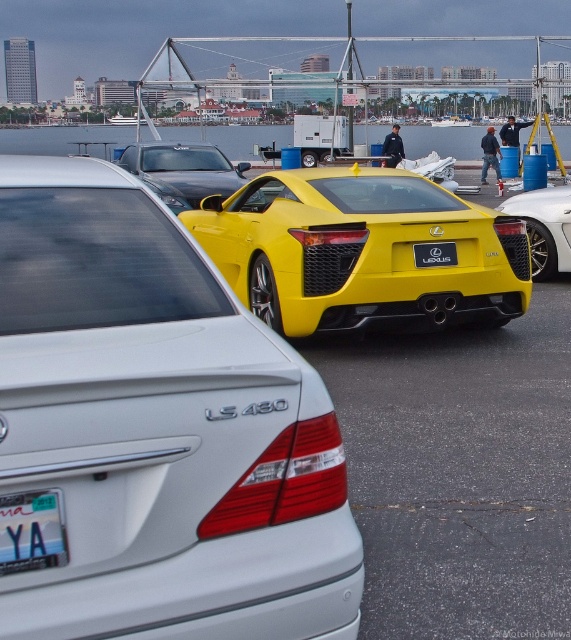
Does satin silver sedan at center lie in front of white plastic license plate at lower left?

That is True.

Is point (222, 500) in front of point (26, 500)?

No, (222, 500) is behind (26, 500).

Describe the element at coordinates (158, 428) in the screenshot. I see `satin silver sedan at center` at that location.

This screenshot has height=640, width=571. I want to click on satin silver sedan at center, so click(158, 428).

Is yellow matte sports car at center bigger than white plastic license plate at lower left?

Indeed, yellow matte sports car at center has a larger size compared to white plastic license plate at lower left.

Image resolution: width=571 pixels, height=640 pixels. I want to click on yellow matte sports car at center, so click(x=361, y=252).

Between point (348, 621) and point (231, 188), which one is positioned in front?

Point (348, 621) is more forward.

Does satin silver sedan at center lie behind shiny black sedan at center?

No, satin silver sedan at center is in front of shiny black sedan at center.

Is point (26, 282) positioned in front of point (187, 157)?

Yes.

Locate an element on the screen. The width and height of the screenshot is (571, 640). satin silver sedan at center is located at coordinates (158, 428).